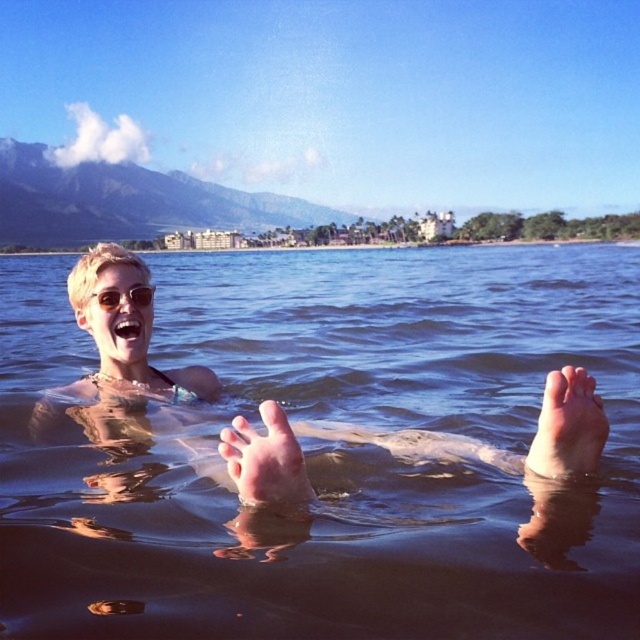
You are a photographer taking a picture of the scene. You notice the pink flesh at lower right and the shiny silver sunglasses at upper center. Which object should you focus on if you want to capture the one that is taller?

The pink flesh at lower right is taller than the shiny silver sunglasses at upper center, so you should focus on the pink flesh at lower right.

In the scene shown: You are a photographer trying to capture the perfect shot of the swimmer. You notice the pink flesh at lower right and the shiny silver sunglasses at upper center. Which object should you focus on first if you want to frame the swimmer from left to right?

The pink flesh at lower right is to the right of the shiny silver sunglasses at upper center, so you should focus on the shiny silver sunglasses at upper center first to frame the swimmer from left to right.

You are a photographer taking a picture of the scene. You want to focus on the clear water at feet center and the pink flesh at lower right. Which object should you adjust your camera to focus on first if you want to capture both in sharp detail?

The clear water at feet center should be focused on first because it is closer to the viewer than the pink flesh at lower right, allowing for better depth of field when capturing both objects.